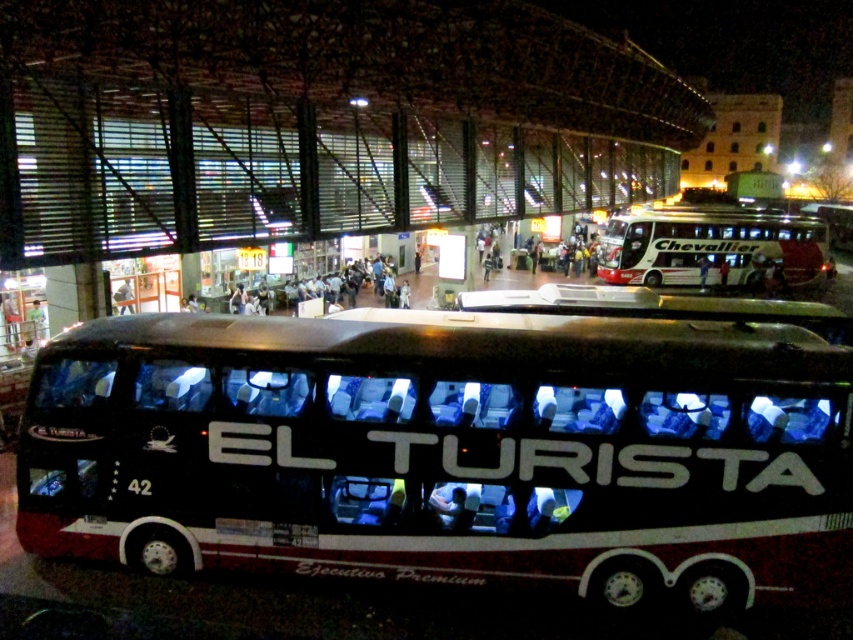
Question: Which of the following is the closest to the observer?

Choices:
 (A) white glossy bus at upper right
 (B) black matte bus at center

Answer: (B)

Question: Does black matte bus at center appear on the right side of white glossy bus at upper right?

Choices:
 (A) yes
 (B) no

Answer: (B)

Question: Does black matte bus at center have a greater width compared to white glossy bus at upper right?

Choices:
 (A) yes
 (B) no

Answer: (B)

Question: Does black matte bus at center have a greater width compared to white glossy bus at upper right?

Choices:
 (A) yes
 (B) no

Answer: (B)

Question: Which of the following is the closest to the observer?

Choices:
 (A) (698, 273)
 (B) (328, 451)

Answer: (B)

Question: Which point is closer to the camera?

Choices:
 (A) (729, 225)
 (B) (738, 499)

Answer: (B)